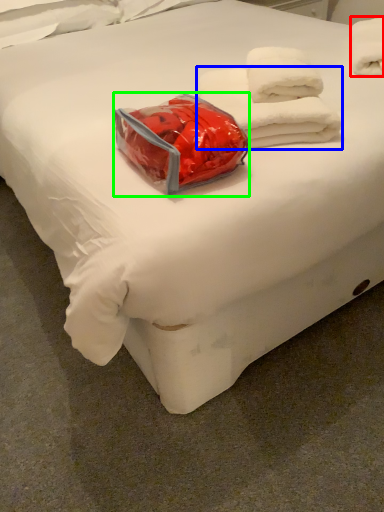
Question: Which is nearer to the towel (highlighted by a red box)? towel (highlighted by a blue box) or package (highlighted by a green box).

Choices:
 (A) towel
 (B) package

Answer: (A)